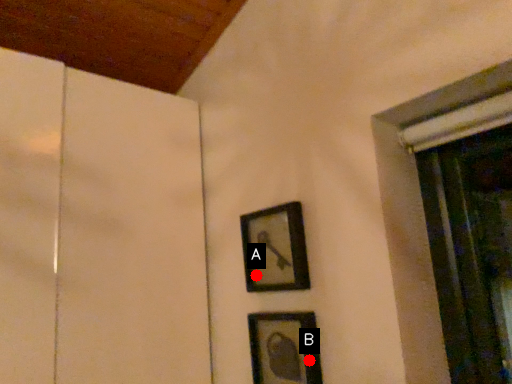
Question: Two points are circled on the image, labeled by A and B beside each circle. Which point is further to the camera?

Choices:
 (A) A is further
 (B) B is further

Answer: (A)